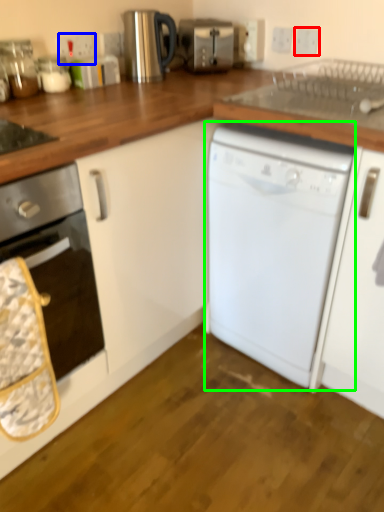
Question: Based on their relative distances, which object is farther from electric outlet (highlighted by a red box)? Choose from electric outlet (highlighted by a blue box) and dishwasher (highlighted by a green box).

Choices:
 (A) electric outlet
 (B) dishwasher

Answer: (B)